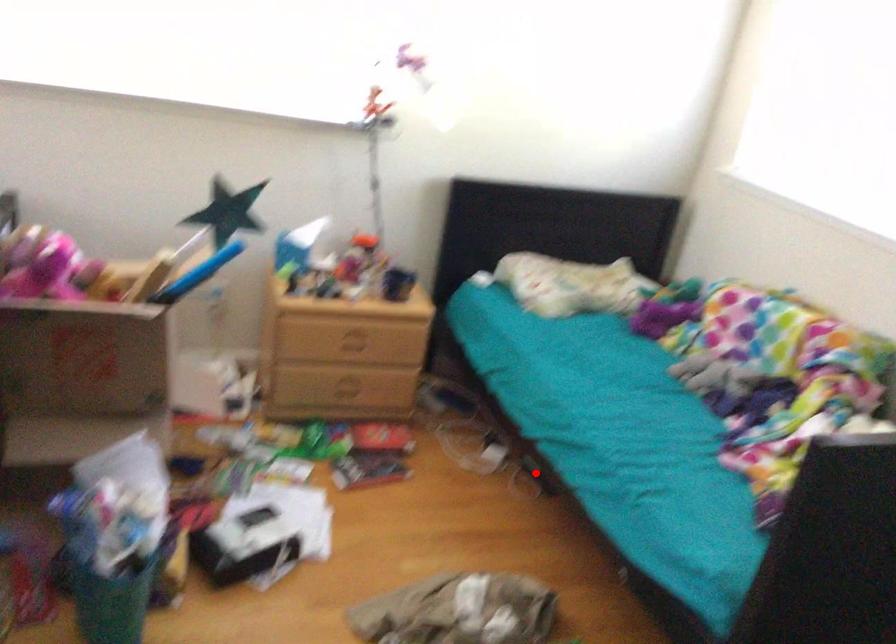
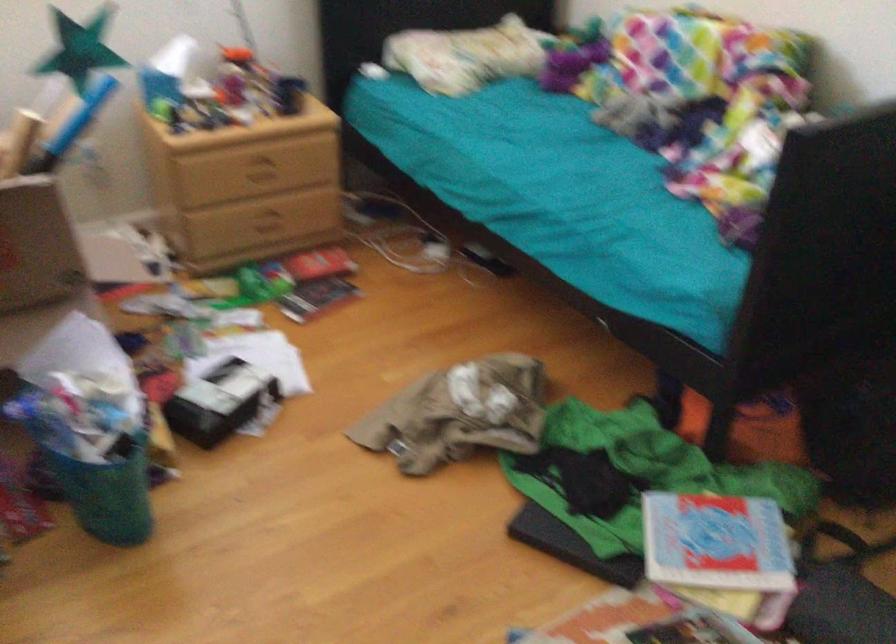
Find the pixel in the second image that matches the highlighted location in the first image.

(481, 259)